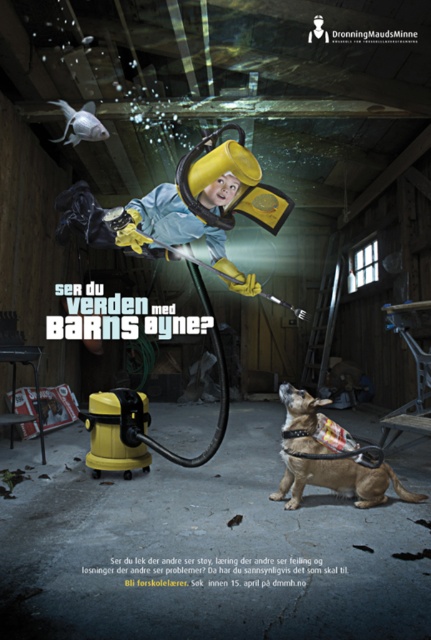
Question: Among these points, which one is farthest from the camera?

Choices:
 (A) (349, 483)
 (B) (49, 406)

Answer: (B)

Question: Among these points, which one is farthest from the camera?

Choices:
 (A) (284, 445)
 (B) (65, 396)

Answer: (B)

Question: Considering the relative positions of brown leather dog at lower right and metallic silver sign at lower left in the image provided, where is brown leather dog at lower right located with respect to metallic silver sign at lower left?

Choices:
 (A) left
 (B) right

Answer: (B)

Question: Can you confirm if brown leather dog at lower right is thinner than metallic silver sign at lower left?

Choices:
 (A) yes
 (B) no

Answer: (B)

Question: Is brown leather dog at lower right below metallic silver sign at lower left?

Choices:
 (A) yes
 (B) no

Answer: (B)

Question: Which point appears closest to the camera in this image?

Choices:
 (A) (66, 404)
 (B) (364, 504)

Answer: (B)